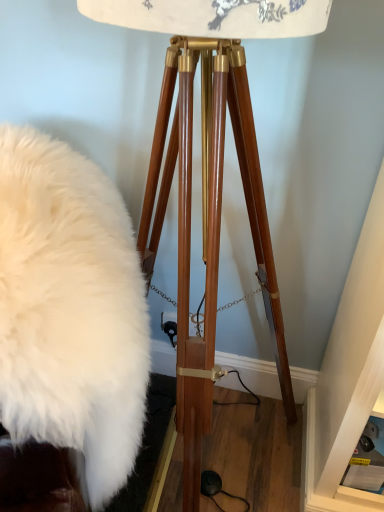
Measure the distance between white fluffy bean bag chair at left and camera.

They are 19.54 inches apart.

Measure the distance between point (135,436) and camera.

Point (135,436) is 30.16 inches away from camera.

Describe the element at coordinates (70, 311) in the screenshot. I see `white fluffy bean bag chair at left` at that location.

The image size is (384, 512). What are the coordinates of `white fluffy bean bag chair at left` in the screenshot? It's located at (70, 311).

In order to face white fluffy bean bag chair at left, should I rotate leftwards or rightwards?

Turn left approximately 18.281 degrees to face it.

In order to click on white fluffy bean bag chair at left in this screenshot , I will do `click(70, 311)`.